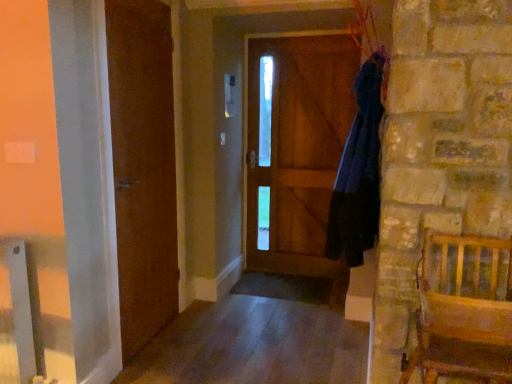
This screenshot has height=384, width=512. What are the coordinates of `free spot to the right of brown wooden door at left` in the screenshot? It's located at (230, 349).